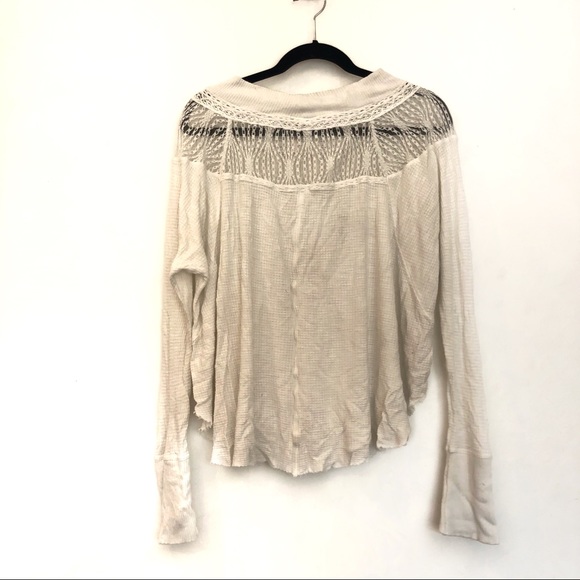
Where is `wall`? The height and width of the screenshot is (580, 580). wall is located at coordinates (79, 361).